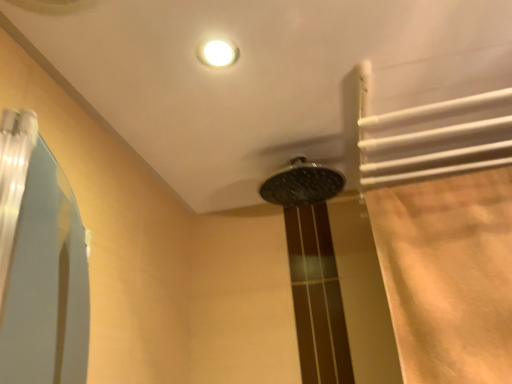
Find the location of a particular element. The height and width of the screenshot is (384, 512). polished chrome showerhead at center is located at coordinates (302, 184).

What is the approximate width of polished chrome showerhead at center?

polished chrome showerhead at center is 9.78 inches in width.

Describe the element at coordinates (302, 184) in the screenshot. The height and width of the screenshot is (384, 512). I see `polished chrome showerhead at center` at that location.

Identify the location of beige fabric shower curtain at right. The height and width of the screenshot is (384, 512). (442, 211).

Describe the element at coordinates (442, 211) in the screenshot. I see `beige fabric shower curtain at right` at that location.

Locate an element on the screen. polished chrome showerhead at center is located at coordinates (302, 184).

Considering the positions of objects beige fabric shower curtain at right and polished chrome showerhead at center in the image provided, who is more to the right, beige fabric shower curtain at right or polished chrome showerhead at center?

Positioned to the right is beige fabric shower curtain at right.

Which object is further away from the camera taking this photo, beige fabric shower curtain at right or polished chrome showerhead at center?

polished chrome showerhead at center is more distant.

Is point (420, 135) closer or farther from the camera than point (302, 183)?

Point (420, 135) appears to be closer to the viewer than point (302, 183).

From the image's perspective, is beige fabric shower curtain at right on polished chrome showerhead at center?

No, from the image's perspective, beige fabric shower curtain at right is not over polished chrome showerhead at center.

Looking at this image, from a real-world perspective, between beige fabric shower curtain at right and polished chrome showerhead at center, who is vertically higher?

polished chrome showerhead at center, from a real-world perspective.

Is beige fabric shower curtain at right wider than polished chrome showerhead at center?

No, beige fabric shower curtain at right is not wider than polished chrome showerhead at center.

Considering the sizes of beige fabric shower curtain at right and polished chrome showerhead at center in the image, is beige fabric shower curtain at right taller or shorter than polished chrome showerhead at center?

beige fabric shower curtain at right is taller than polished chrome showerhead at center.

In terms of size, does beige fabric shower curtain at right appear bigger or smaller than polished chrome showerhead at center?

In the image, beige fabric shower curtain at right appears to be larger than polished chrome showerhead at center.

Could polished chrome showerhead at center be considered to be inside beige fabric shower curtain at right?

No, beige fabric shower curtain at right does not contain polished chrome showerhead at center.

Consider the image. Is there a large distance between beige fabric shower curtain at right and polished chrome showerhead at center?

That's not correct — beige fabric shower curtain at right is a little close to polished chrome showerhead at center.

Could you tell me if beige fabric shower curtain at right is turned towards polished chrome showerhead at center?

No, beige fabric shower curtain at right is not turned towards polished chrome showerhead at center.

How different are the orientations of beige fabric shower curtain at right and polished chrome showerhead at center in degrees?

1.45e-05 degrees separate the facing orientations of beige fabric shower curtain at right and polished chrome showerhead at center.

Find the location of a particular element. shower above the beige fabric shower curtain at right (from the image's perspective) is located at coordinates (302, 184).

In the image, is polished chrome showerhead at center on the left side or the right side of beige fabric shower curtain at right?

From the image, it's evident that polished chrome showerhead at center is to the left of beige fabric shower curtain at right.

Considering their positions, is polished chrome showerhead at center located in front of or behind beige fabric shower curtain at right?

Clearly, polished chrome showerhead at center is behind beige fabric shower curtain at right.

Which point is more forward, [293,203] or [472,146]?

The point [472,146] is more forward.

From the image's perspective, which is above, polished chrome showerhead at center or beige fabric shower curtain at right?

From the image's view, polished chrome showerhead at center is above.

From a real-world perspective, is polished chrome showerhead at center above or below beige fabric shower curtain at right?

polished chrome showerhead at center is situated higher than beige fabric shower curtain at right in the real world.

Considering the relative sizes of polished chrome showerhead at center and beige fabric shower curtain at right in the image provided, is polished chrome showerhead at center wider than beige fabric shower curtain at right?

Yes.

Between polished chrome showerhead at center and beige fabric shower curtain at right, which one has more height?

Standing taller between the two is beige fabric shower curtain at right.

Between polished chrome showerhead at center and beige fabric shower curtain at right, which one has larger size?

With larger size is beige fabric shower curtain at right.

Choose the correct answer: Is polished chrome showerhead at center inside beige fabric shower curtain at right or outside it?

The correct answer is: outside.

Would you consider polished chrome showerhead at center to be distant from beige fabric shower curtain at right?

No.

Is polished chrome showerhead at center facing away from beige fabric shower curtain at right?

That's not correct — polished chrome showerhead at center is not looking away from beige fabric shower curtain at right.

Locate an element on the screen. The height and width of the screenshot is (384, 512). shower above the beige fabric shower curtain at right (from a real-world perspective) is located at coordinates (302, 184).

This screenshot has height=384, width=512. I want to click on shower on the left side of beige fabric shower curtain at right, so click(x=302, y=184).

The height and width of the screenshot is (384, 512). I want to click on shower curtain below the polished chrome showerhead at center (from a real-world perspective), so click(x=442, y=211).